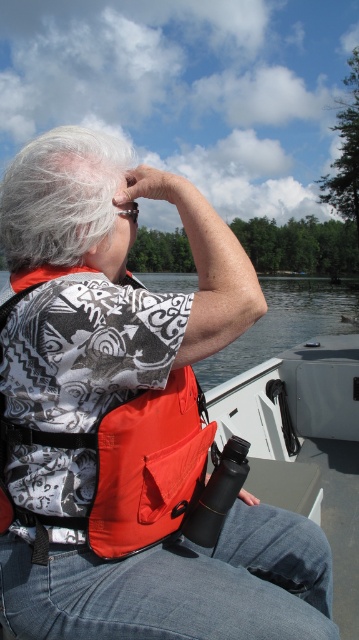
You are a photographer trying to capture a clear shot of the orange fabric life jacket at center and the white fluffy hair at upper left. Which object should you focus on first to ensure it appears sharp in your photo?

The orange fabric life jacket at center is closer to the viewer than the white fluffy hair at upper left, so you should focus on the orange fabric life jacket at center first to ensure it appears sharp in your photo.

You are standing on the dock and want to throw a life ring to the person on the boat. The life ring has a diameter of 0.8 meters. Can you reach the person if the point where you need to aim is at point (178,406)?

The distance between you and the person at point (178,406) is 1.26 meters. Since the life ring has a diameter of 0.8 meters, you can reach them as the distance is greater than the life ring size.